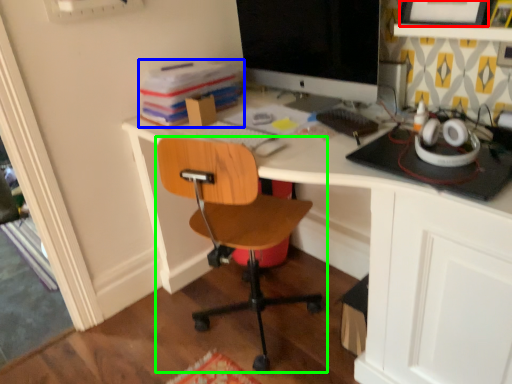
Question: Estimate the real-world distances between objects in this image. Which object is farther from picture frame (highlighted by a red box), book (highlighted by a blue box) or chair (highlighted by a green box)?

Choices:
 (A) book
 (B) chair

Answer: (B)